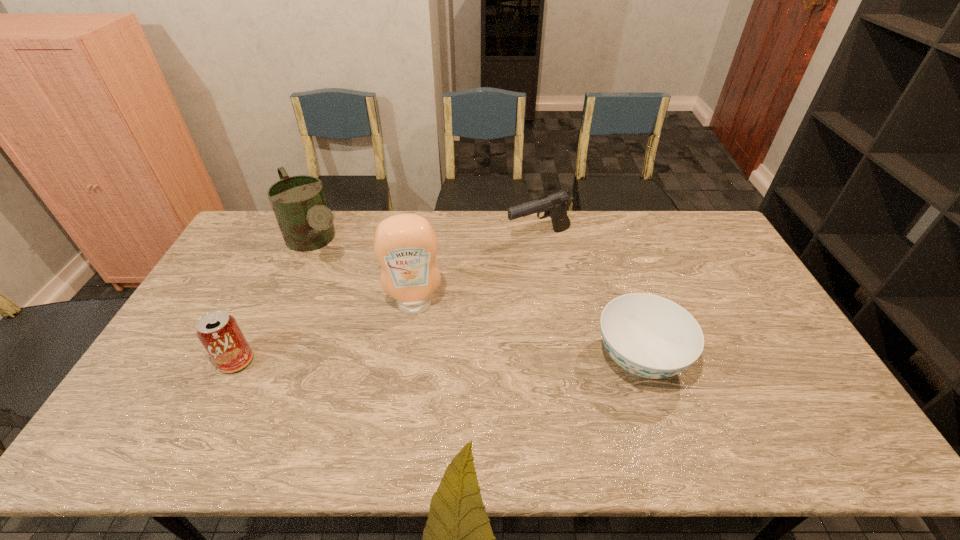
Locate an element on the screen. free space between the shortest object and the second tallest object is located at coordinates (478, 301).

Where is `free point between the soda can and the chinaware`? free point between the soda can and the chinaware is located at coordinates (438, 360).

What are the coordinates of `empty space between the chinaware and the soda can` in the screenshot? It's located at (438, 360).

This screenshot has height=540, width=960. I want to click on vacant space that's between the gun and the third farthest object, so click(x=477, y=271).

The width and height of the screenshot is (960, 540). I want to click on unoccupied position between the soda can and the gun, so click(388, 299).

This screenshot has height=540, width=960. What are the coordinates of `vacant space in between the fourth shortest object and the third object from right to left` in the screenshot? It's located at click(366, 274).

The image size is (960, 540). Identify the location of object that ranks as the third closest to the watering can. (554, 206).

You are a GUI agent. You are given a task and a screenshot of the screen. Output one action in this format:
    pyautogui.click(x=<x>, y=<y>)
    Task: Click on the object that is the fourth closest to the watering can
    The height and width of the screenshot is (540, 960).
    Given the screenshot: What is the action you would take?
    pyautogui.click(x=650, y=336)

At what (x,y) coordinates should I click in order to perform the action: click on free space in the image that satisfies the following two spatial constraints: 1. on the front side of the chinaware; 2. on the left side of the watering can. Please return your answer as a coordinate pair (x, y). Looking at the image, I should click on (267, 359).

Identify the location of vacant space that satisfies the following two spatial constraints: 1. on the back side of the chinaware; 2. on the left side of the soda can. 237,359.